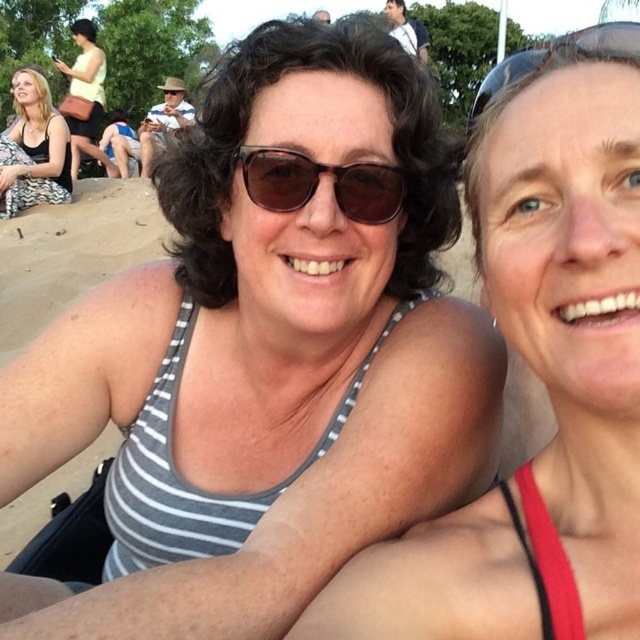
Can you confirm if beige sand at lower left is positioned to the right of matte black tank top at lower left?

Yes, beige sand at lower left is to the right of matte black tank top at lower left.

Is beige sand at lower left closer to the viewer compared to matte black tank top at lower left?

Yes, it is.

Which is in front, point (118, 188) or point (35, 97)?

Point (35, 97) is in front.

Locate an element on the screen. The height and width of the screenshot is (640, 640). beige sand at lower left is located at coordinates (72, 252).

Which of these two, brown matte sunglasses at center or matte black tank top at lower left, stands shorter?

With less height is brown matte sunglasses at center.

Between point (388, 168) and point (60, 122), which one is positioned in front?

Point (388, 168)

Which is in front, point (259, 168) or point (42, 195)?

Positioned in front is point (259, 168).

What are the coordinates of `brown matte sunglasses at center` in the screenshot? It's located at (317, 182).

Is gray striped tank top at center below matte black tank top at lower left?

Correct, gray striped tank top at center is located below matte black tank top at lower left.

Is gray striped tank top at center closer to the viewer compared to matte black tank top at lower left?

Yes, it is in front of matte black tank top at lower left.

You are a GUI agent. You are given a task and a screenshot of the screen. Output one action in this format:
    pyautogui.click(x=<x>, y=<y>)
    Task: Click on the gray striped tank top at center
    
    Given the screenshot: What is the action you would take?
    pyautogui.click(x=538, y=374)

Where is `gray striped tank top at center`? The width and height of the screenshot is (640, 640). gray striped tank top at center is located at coordinates (538, 374).